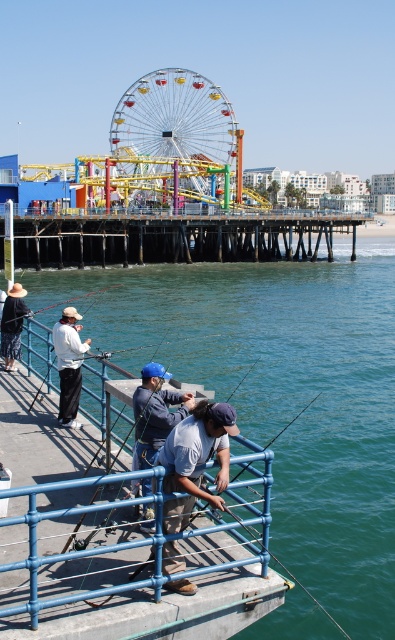
Question: Which of the following is the closest to the observer?

Choices:
 (A) dark blue denim jacket at left
 (B) white matte shirt at center
 (C) matte black fishing pole at lower left

Answer: (B)

Question: In this image, where is multicolored metallic ferris wheel at center located relative to matte black fishing pole at lower left?

Choices:
 (A) below
 (B) above

Answer: (B)

Question: Considering the relative positions of wooden at center and matte black fishing pole at lower left in the image provided, where is wooden at center located with respect to matte black fishing pole at lower left?

Choices:
 (A) below
 (B) above

Answer: (B)

Question: From the image, what is the correct spatial relationship of wooden at center in relation to multicolored metallic ferris wheel at center?

Choices:
 (A) above
 (B) below

Answer: (B)

Question: Which object appears farthest from the camera in this image?

Choices:
 (A) white matte shirt at center
 (B) green water at lower center
 (C) matte black fishing pole at lower left

Answer: (C)

Question: Which object is closer to the camera taking this photo?

Choices:
 (A) blue denim shirt at center
 (B) light blue denim shirt at center
 (C) white matte shirt at center

Answer: (B)